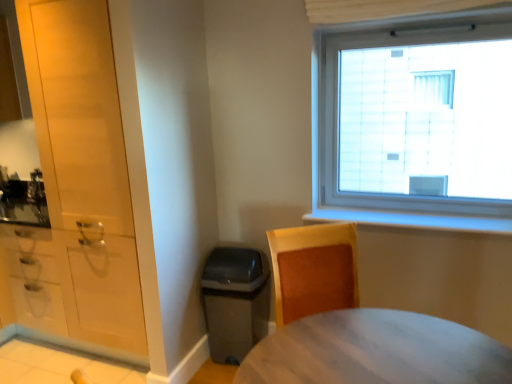
Question: Considering the positions of matte white cabinet at left, the 2th cabinetry from the left, and matte white cabinets at left, acting as the 1th cabinetry starting from the left, in the image, is matte white cabinet at left, the 2th cabinetry from the left, bigger or smaller than matte white cabinets at left, acting as the 1th cabinetry starting from the left,?

Choices:
 (A) big
 (B) small

Answer: (A)

Question: Is point (53, 251) positioned closer to the camera than point (128, 291)?

Choices:
 (A) closer
 (B) farther

Answer: (B)

Question: Which object is positioned closest to the matte white cabinets at left, acting as the 1th cabinetry starting from the left?

Choices:
 (A) matte white cabinet at left, acting as the 1th cabinetry starting from the right
 (B) wooden desk at lower right

Answer: (A)

Question: Considering the real-world distances, which object is farthest from the wooden desk at lower right?

Choices:
 (A) matte white cabinet at left, the 2th cabinetry from the left
 (B) matte white cabinets at left, which ranks as the 2th cabinetry in right-to-left order

Answer: (A)